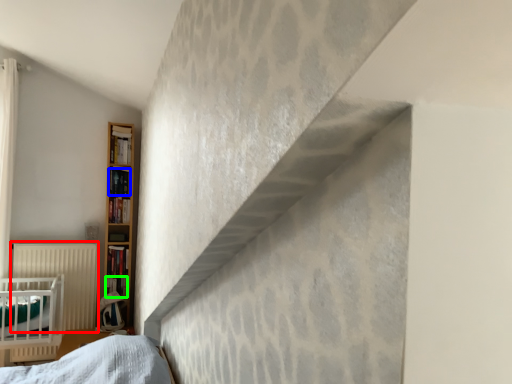
Question: Estimate the real-world distances between objects in this image. Which object is closer to radiator (highlighted by a red box), book (highlighted by a blue box) or book (highlighted by a green box)?

Choices:
 (A) book
 (B) book

Answer: (B)